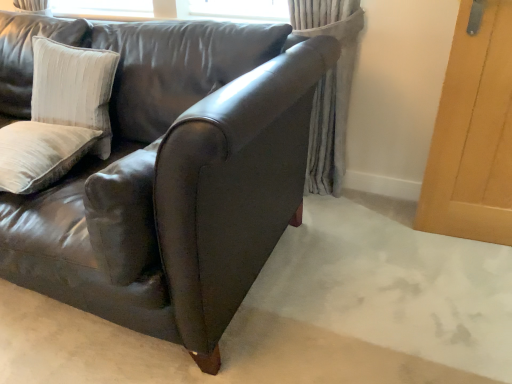
Question: Is beige velvet pillow at left, which appears as the 2th pillow when viewed from the top, placed right next to velvet beige pillow at upper left, which is counted as the 2th pillow, starting from the bottom?

Choices:
 (A) yes
 (B) no

Answer: (B)

Question: Considering the relative sizes of beige velvet pillow at left, which appears as the 2th pillow when viewed from the top, and velvet beige pillow at upper left, which is the 1th pillow from top to bottom, in the image provided, is beige velvet pillow at left, which appears as the 2th pillow when viewed from the top, wider than velvet beige pillow at upper left, which is the 1th pillow from top to bottom,?

Choices:
 (A) yes
 (B) no

Answer: (A)

Question: Is beige velvet pillow at left, which appears as the 2th pillow when viewed from the top, at the left side of velvet beige pillow at upper left, which is the 1th pillow from top to bottom?

Choices:
 (A) no
 (B) yes

Answer: (B)

Question: Does beige velvet pillow at left, marked as the 1th pillow in a bottom-to-top arrangement, lie in front of velvet beige pillow at upper left, which is the 1th pillow from top to bottom?

Choices:
 (A) yes
 (B) no

Answer: (A)

Question: Is beige velvet pillow at left, which appears as the 2th pillow when viewed from the top, taller than velvet beige pillow at upper left, which is the 1th pillow from top to bottom?

Choices:
 (A) no
 (B) yes

Answer: (A)

Question: Is shiny leather couch at center taller or shorter than beige velvet pillow at left, marked as the 1th pillow in a bottom-to-top arrangement?

Choices:
 (A) tall
 (B) short

Answer: (A)

Question: In terms of width, does shiny leather couch at center look wider or thinner when compared to beige velvet pillow at left, which appears as the 2th pillow when viewed from the top?

Choices:
 (A) thin
 (B) wide

Answer: (B)

Question: Considering the positions of point (207, 62) and point (28, 157), is point (207, 62) closer or farther from the camera than point (28, 157)?

Choices:
 (A) closer
 (B) farther

Answer: (B)

Question: From a real-world perspective, is shiny leather couch at center physically located above or below beige velvet pillow at left, marked as the 1th pillow in a bottom-to-top arrangement?

Choices:
 (A) below
 (B) above

Answer: (A)

Question: Considering the positions of velvet beige pillow at upper left, which is counted as the 2th pillow, starting from the bottom, and beige velvet pillow at left, which appears as the 2th pillow when viewed from the top, in the image, is velvet beige pillow at upper left, which is counted as the 2th pillow, starting from the bottom, bigger or smaller than beige velvet pillow at left, which appears as the 2th pillow when viewed from the top,?

Choices:
 (A) small
 (B) big

Answer: (B)

Question: Considering the positions of velvet beige pillow at upper left, which is the 1th pillow from top to bottom, and beige velvet pillow at left, marked as the 1th pillow in a bottom-to-top arrangement, in the image, is velvet beige pillow at upper left, which is the 1th pillow from top to bottom, taller or shorter than beige velvet pillow at left, marked as the 1th pillow in a bottom-to-top arrangement,?

Choices:
 (A) tall
 (B) short

Answer: (A)

Question: Does point (56, 56) appear closer or farther from the camera than point (13, 125)?

Choices:
 (A) closer
 (B) farther

Answer: (B)

Question: Relative to beige velvet pillow at left, which appears as the 2th pillow when viewed from the top, is velvet beige pillow at upper left, which is the 1th pillow from top to bottom, in front or behind?

Choices:
 (A) behind
 (B) front

Answer: (A)

Question: Do you think velvet beige pillow at upper left, which is the 1th pillow from top to bottom, is within gray textured curtain at center, or outside of it?

Choices:
 (A) inside
 (B) outside

Answer: (B)

Question: In terms of height, does velvet beige pillow at upper left, which is counted as the 2th pillow, starting from the bottom, look taller or shorter compared to gray textured curtain at center?

Choices:
 (A) short
 (B) tall

Answer: (A)